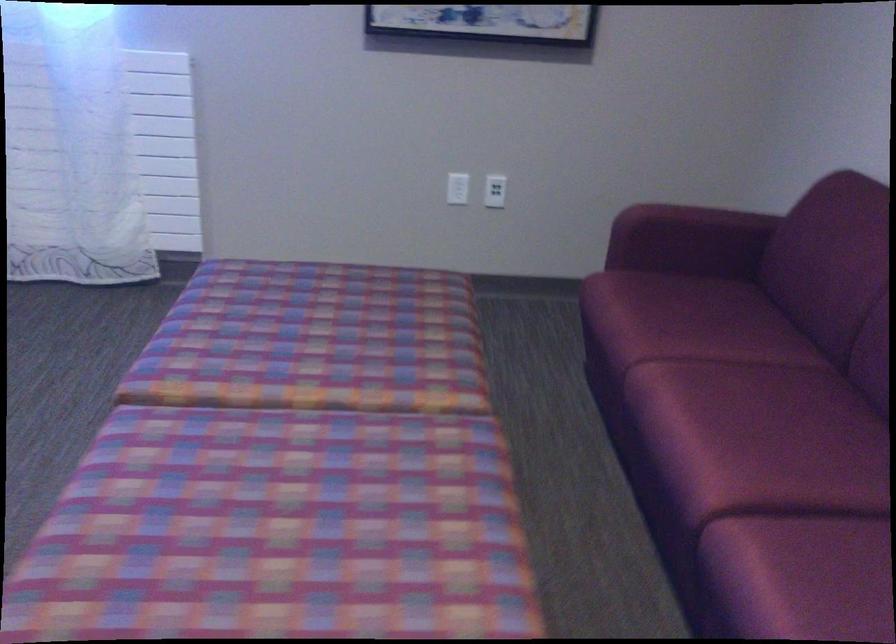
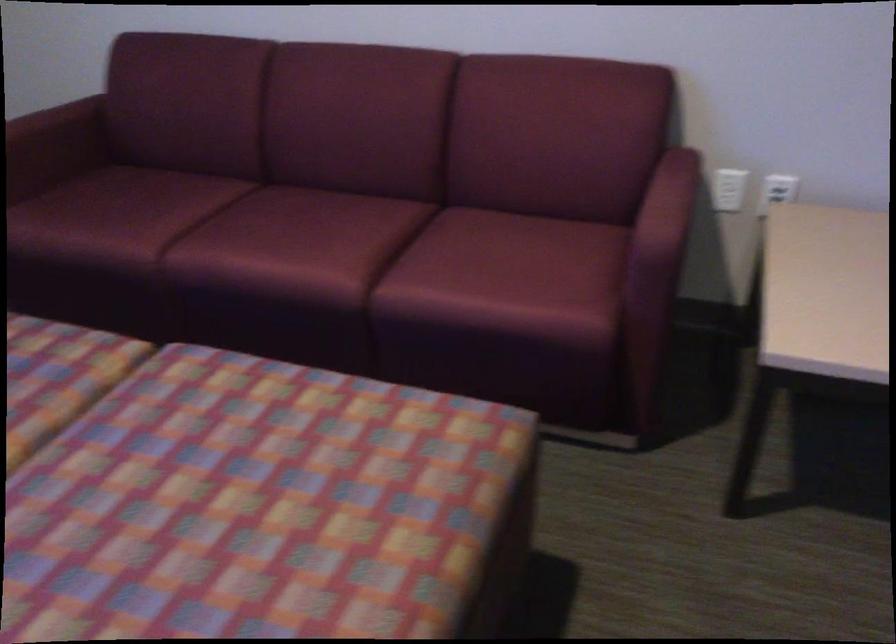
Find the pixel in the second image that matches [737,460] in the first image.

(332, 249)